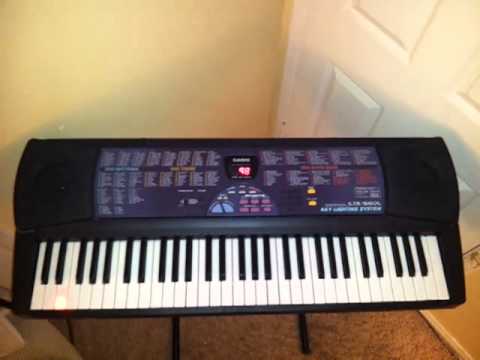
You are a GUI agent. You are given a task and a screenshot of the screen. Output one action in this format:
    pyautogui.click(x=<x>, y=<y>)
    Task: Click on the screen
    
    Given the screenshot: What is the action you would take?
    pyautogui.click(x=238, y=170)